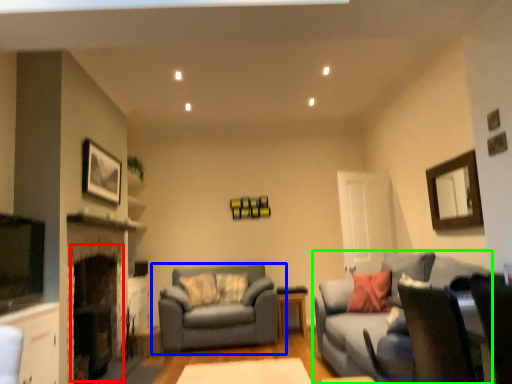
Question: Considering the real-world distances, which object is farthest from fireplace (highlighted by a red box)? studio couch (highlighted by a blue box) or studio couch (highlighted by a green box)?

Choices:
 (A) studio couch
 (B) studio couch

Answer: (B)